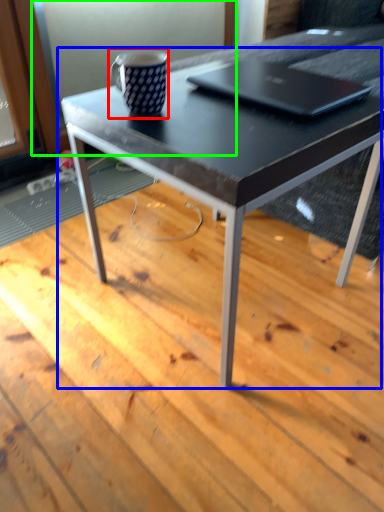
Question: Estimate the real-world distances between objects in this image. Which object is farther from coffee cup (highlighted by a red box), coffee table (highlighted by a blue box) or screen door (highlighted by a green box)?

Choices:
 (A) coffee table
 (B) screen door

Answer: (B)